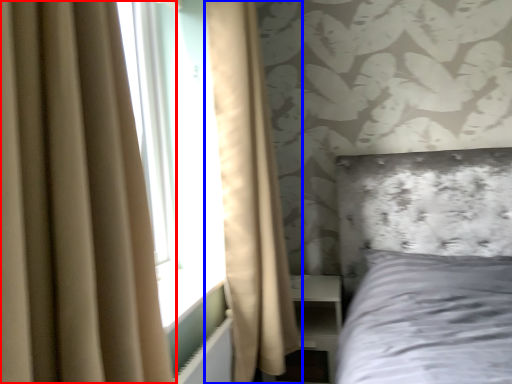
Question: Which point is further to the camera, curtain (highlighted by a red box) or curtain (highlighted by a blue box)?

Choices:
 (A) curtain
 (B) curtain

Answer: (B)